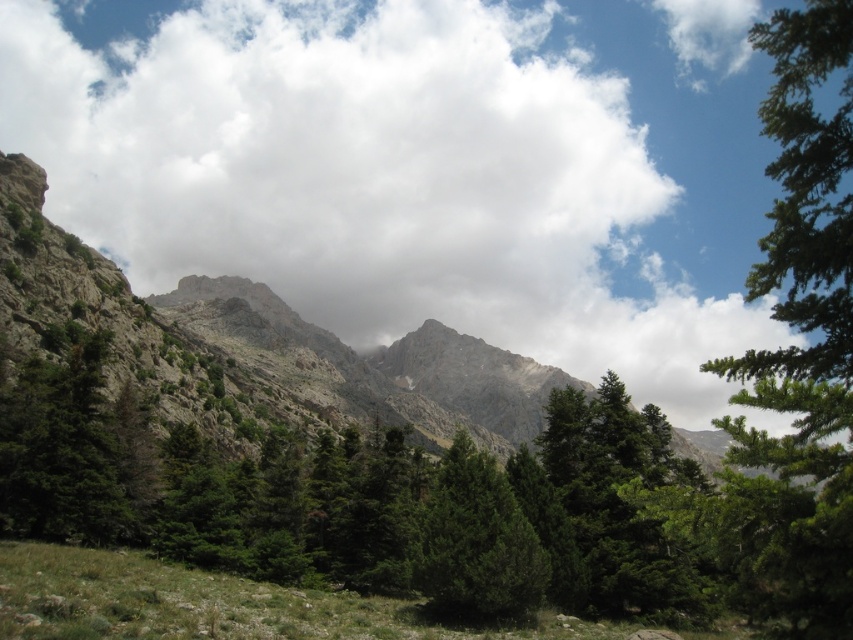
You are a hiker planning to take a photo of the white fluffy cloud at upper center and the green matte tree at left. Which object will appear bigger in your photo?

The white fluffy cloud at upper center will appear bigger in the photo because it has a larger size compared to the green matte tree at left.

You are a hiker standing in the forest and want to reach the green matte tree at center. Which direction should you move relative to the green matte tree at left?

You should move away from the green matte tree at left to reach the green matte tree at center because the green matte tree at left is closer to you than the green matte tree at center.